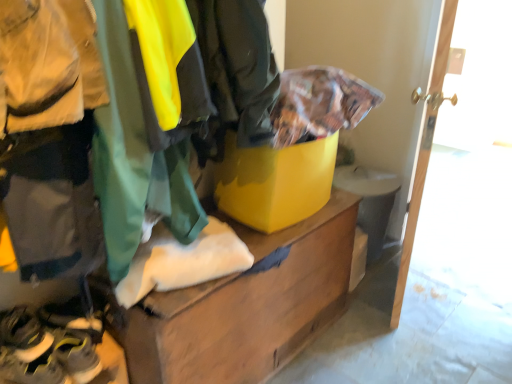
This screenshot has height=384, width=512. What are the coordinates of `empty space that is ontop of yellow mesh sneakers at lower left, which is the 1th footwear in bottom-to-top order` in the screenshot? It's located at (62, 336).